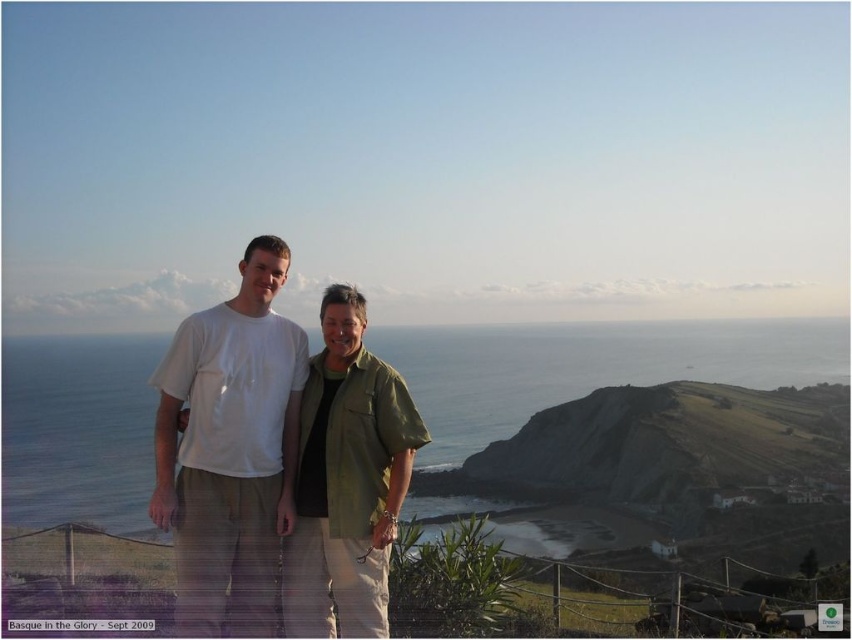
You are a photographer planning to take a group photo of the blue water at center and the green fabric shirt at center. Based on the scene, which object occupies more horizontal space in the image?

The blue water at center has a greater width than the green fabric shirt at center, so it occupies more horizontal space in the image.